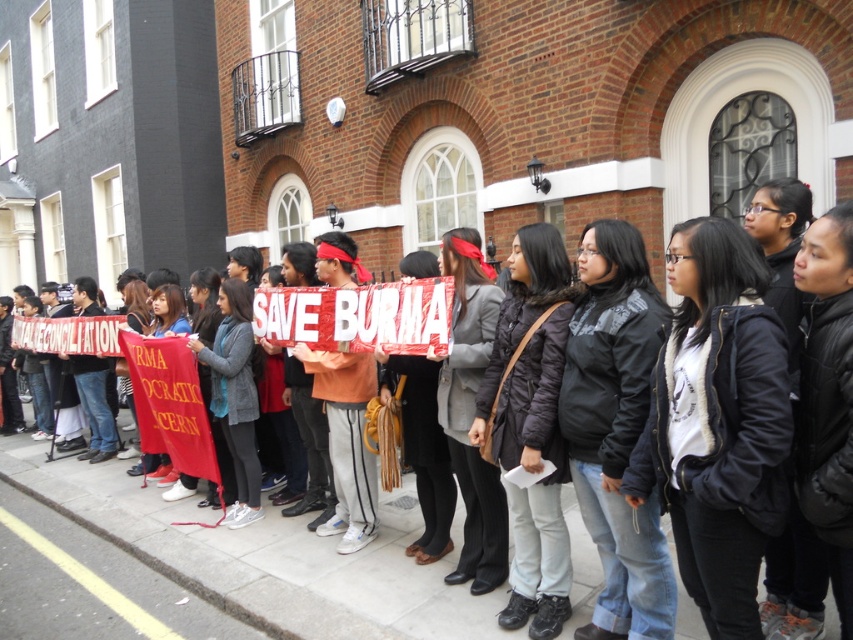
Question: Is red fabric banner at center further to the viewer compared to yellow painted line at lower center?

Choices:
 (A) no
 (B) yes

Answer: (B)

Question: Among these points, which one is nearest to the camera?

Choices:
 (A) (573, 556)
 (B) (67, 557)

Answer: (A)

Question: Does red fabric banner at center lie in front of yellow painted line at lower center?

Choices:
 (A) yes
 (B) no

Answer: (B)

Question: Is red fabric banner at center below yellow painted line at lower center?

Choices:
 (A) yes
 (B) no

Answer: (B)

Question: Which of the following is the farthest from the observer?

Choices:
 (A) yellow painted line at lower center
 (B) red fabric banner at center

Answer: (B)